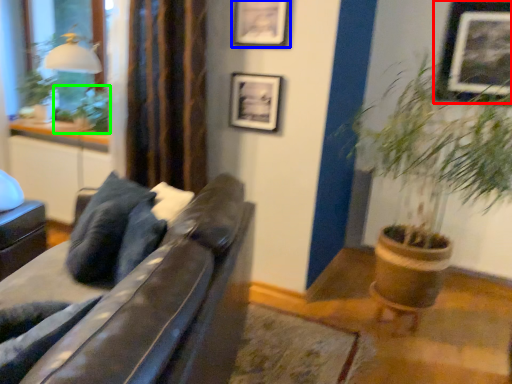
Question: Considering the real-world distances, which object is farthest from picture frame (highlighted by a red box)? picture frame (highlighted by a blue box) or plant (highlighted by a green box)?

Choices:
 (A) picture frame
 (B) plant

Answer: (B)